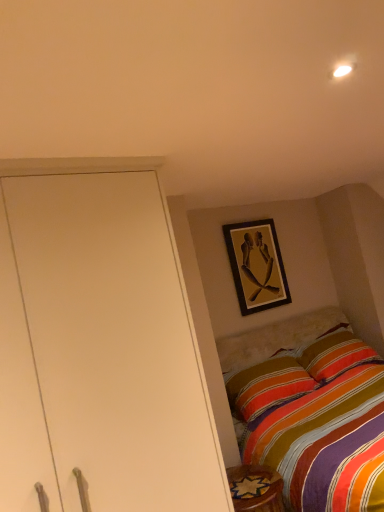
What do you see at coordinates (256, 265) in the screenshot? The image size is (384, 512). I see `wooden framed artwork at upper center` at bounding box center [256, 265].

The height and width of the screenshot is (512, 384). Identify the location of wooden framed artwork at upper center. (256, 265).

Identify the location of carpeted rug at lower right. Image resolution: width=384 pixels, height=512 pixels. (255, 489).

What do you see at coordinates (255, 489) in the screenshot? The image size is (384, 512). I see `carpeted rug at lower right` at bounding box center [255, 489].

Where is `wooden framed artwork at upper center`? This screenshot has height=512, width=384. wooden framed artwork at upper center is located at coordinates (256, 265).

Considering the positions of objects wooden framed artwork at upper center and carpeted rug at lower right in the image provided, who is more to the left, wooden framed artwork at upper center or carpeted rug at lower right?

carpeted rug at lower right is more to the left.

Is the position of wooden framed artwork at upper center less distant than that of carpeted rug at lower right?

No, it is not.

Considering the positions of point (246, 232) and point (280, 487), is point (246, 232) closer or farther from the camera than point (280, 487)?

Point (246, 232) appears to be farther away from the viewer than point (280, 487).

From the image's perspective, is wooden framed artwork at upper center located above or below carpeted rug at lower right?

Based on their image positions, wooden framed artwork at upper center is located above carpeted rug at lower right.

From a real-world perspective, between wooden framed artwork at upper center and carpeted rug at lower right, who is vertically higher?

From a 3D spatial view, wooden framed artwork at upper center is above.

Between wooden framed artwork at upper center and carpeted rug at lower right, which one has larger width?

carpeted rug at lower right is wider.

In terms of height, does wooden framed artwork at upper center look taller or shorter compared to carpeted rug at lower right?

In the image, wooden framed artwork at upper center appears to be taller than carpeted rug at lower right.

Does wooden framed artwork at upper center have a smaller size compared to carpeted rug at lower right?

No.

Would you say carpeted rug at lower right is part of wooden framed artwork at upper center's contents?

No, carpeted rug at lower right is not surrounded by wooden framed artwork at upper center.

Is wooden framed artwork at upper center next to carpeted rug at lower right and touching it?

No, wooden framed artwork at upper center is not in contact with carpeted rug at lower right.

Is wooden framed artwork at upper center aimed at carpeted rug at lower right?

No, wooden framed artwork at upper center is not turned towards carpeted rug at lower right.

In the scene shown: How many degrees apart are the facing directions of wooden framed artwork at upper center and carpeted rug at lower right?

wooden framed artwork at upper center and carpeted rug at lower right are facing 0.321 degrees away from each other.

Locate an element on the screen. furniture in front of the wooden framed artwork at upper center is located at coordinates (255, 489).

Considering the relative positions of carpeted rug at lower right and wooden framed artwork at upper center in the image provided, is carpeted rug at lower right to the left or to the right of wooden framed artwork at upper center?

carpeted rug at lower right is to the left of wooden framed artwork at upper center.

Which object is closer to the camera taking this photo, carpeted rug at lower right or wooden framed artwork at upper center?

carpeted rug at lower right.

Considering the positions of points (250, 489) and (274, 251), is point (250, 489) closer to camera compared to point (274, 251)?

That is True.

From the image's perspective, relative to wooden framed artwork at upper center, is carpeted rug at lower right above or below?

Clearly, from the image's perspective, carpeted rug at lower right is below wooden framed artwork at upper center.

From a real-world perspective, between carpeted rug at lower right and wooden framed artwork at upper center, who is vertically lower?

carpeted rug at lower right is physically lower.

Between carpeted rug at lower right and wooden framed artwork at upper center, which one has larger width?

carpeted rug at lower right.

Does carpeted rug at lower right have a lesser height compared to wooden framed artwork at upper center?

Yes, carpeted rug at lower right is shorter than wooden framed artwork at upper center.

Considering the relative sizes of carpeted rug at lower right and wooden framed artwork at upper center in the image provided, is carpeted rug at lower right bigger than wooden framed artwork at upper center?

Actually, carpeted rug at lower right might be smaller than wooden framed artwork at upper center.

Is carpeted rug at lower right positioned beyond the bounds of wooden framed artwork at upper center?

carpeted rug at lower right is positioned outside wooden framed artwork at upper center.

Would you consider carpeted rug at lower right to be distant from wooden framed artwork at upper center?

Indeed, carpeted rug at lower right is not near wooden framed artwork at upper center.

Is carpeted rug at lower right looking in the opposite direction of wooden framed artwork at upper center?

carpeted rug at lower right does not have its back to wooden framed artwork at upper center.

Measure the distance from carpeted rug at lower right to wooden framed artwork at upper center.

carpeted rug at lower right is 1.53 meters from wooden framed artwork at upper center.

In the image, there is a wooden framed artwork at upper center. Identify the location of furniture below it (from a real-world perspective). (255, 489).

This screenshot has height=512, width=384. In order to click on picture frame behind the carpeted rug at lower right in this screenshot , I will do `click(256, 265)`.

This screenshot has height=512, width=384. In order to click on picture frame above the carpeted rug at lower right (from a real-world perspective) in this screenshot , I will do `click(256, 265)`.